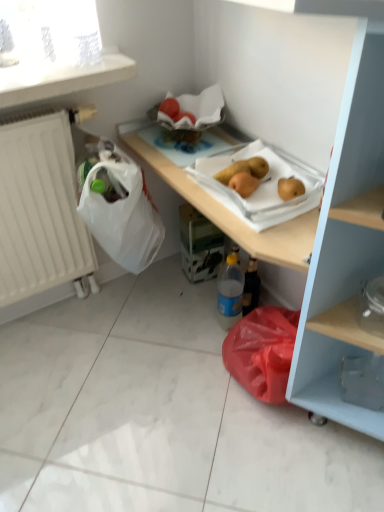
Question: Is yellow matte pear at center located outside blue plastic bottle at lower center?

Choices:
 (A) no
 (B) yes

Answer: (B)

Question: Can you confirm if yellow matte pear at center is bigger than blue plastic bottle at lower center?

Choices:
 (A) yes
 (B) no

Answer: (B)

Question: Considering the relative sizes of yellow matte pear at center and blue plastic bottle at lower center in the image provided, is yellow matte pear at center wider than blue plastic bottle at lower center?

Choices:
 (A) no
 (B) yes

Answer: (B)

Question: Does yellow matte pear at center come behind blue plastic bottle at lower center?

Choices:
 (A) no
 (B) yes

Answer: (A)

Question: Does yellow matte pear at center lie in front of blue plastic bottle at lower center?

Choices:
 (A) yes
 (B) no

Answer: (A)

Question: Is yellow matte pear at center not near blue plastic bottle at lower center?

Choices:
 (A) yes
 (B) no

Answer: (B)

Question: From a real-world perspective, is blue plastic bottle at lower center located beneath transparent plastic carton at center?

Choices:
 (A) yes
 (B) no

Answer: (B)

Question: From the image's perspective, does blue plastic bottle at lower center appear lower than transparent plastic carton at center?

Choices:
 (A) yes
 (B) no

Answer: (A)

Question: Can you confirm if blue plastic bottle at lower center is smaller than transparent plastic carton at center?

Choices:
 (A) yes
 (B) no

Answer: (A)

Question: Is blue plastic bottle at lower center beside transparent plastic carton at center?

Choices:
 (A) no
 (B) yes

Answer: (A)

Question: Could you tell me if blue plastic bottle at lower center is turned towards transparent plastic carton at center?

Choices:
 (A) yes
 (B) no

Answer: (B)

Question: From a real-world perspective, is blue plastic bottle at lower center over transparent plastic carton at center?

Choices:
 (A) no
 (B) yes

Answer: (B)

Question: Does yellow matte pear at center have a greater height compared to white matte radiator at left?

Choices:
 (A) no
 (B) yes

Answer: (A)